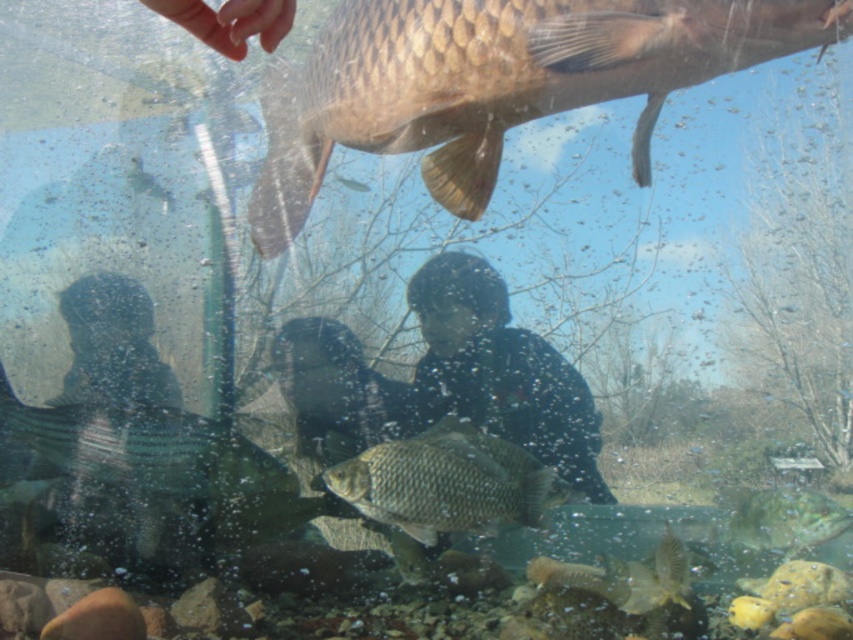
Question: Considering the relative positions of shiny gold fish at upper center and dark blue fabric at center in the image provided, where is shiny gold fish at upper center located with respect to dark blue fabric at center?

Choices:
 (A) above
 (B) below

Answer: (A)

Question: Does shiny gold fish at upper center appear on the left side of shiny silver fish at lower left?

Choices:
 (A) yes
 (B) no

Answer: (B)

Question: Which object appears farthest from the camera in this image?

Choices:
 (A) shiny gold fish at upper center
 (B) dark blue fabric at center
 (C) shiny silver fish at lower left

Answer: (C)

Question: Estimate the real-world distances between objects in this image. Which object is farther from the shiny silver fish at lower left?

Choices:
 (A) shiny silver fish at center
 (B) dark blue fabric at center

Answer: (B)

Question: Does dark blue fabric at center appear on the right side of black matte person at lower left?

Choices:
 (A) yes
 (B) no

Answer: (A)

Question: Which object appears closest to the camera in this image?

Choices:
 (A) black matte person at lower left
 (B) shiny silver fish at lower left
 (C) shiny gold fish at upper center

Answer: (C)